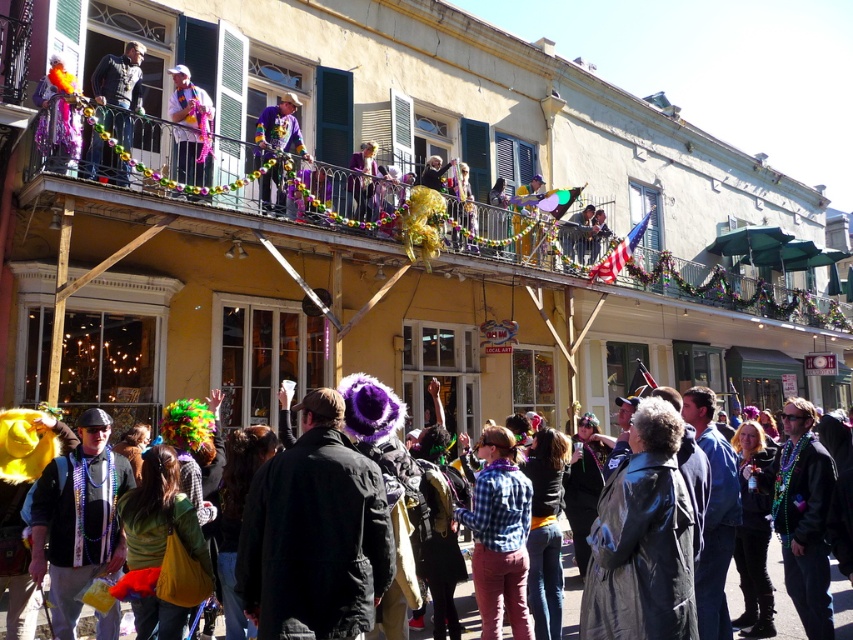
Is matte black jacket at lower left bigger than matte purple hat at upper center?

Correct, matte black jacket at lower left is larger in size than matte purple hat at upper center.

Looking at this image, does matte black jacket at lower left have a lesser width compared to matte purple hat at upper center?

No.

Identify the location of matte black jacket at lower left. (782, 596).

Does matte black jacket at lower left have a greater height compared to matte purple coat at upper center?

Correct, matte black jacket at lower left is much taller as matte purple coat at upper center.

Is point (467, 609) in front of point (358, 189)?

Yes, it is.

Locate an element on the screen. This screenshot has height=640, width=853. matte black jacket at lower left is located at coordinates (782, 596).

Can you confirm if matte purple hat at upper center is smaller than shiny metallic costume at center?

Indeed, matte purple hat at upper center has a smaller size compared to shiny metallic costume at center.

Does matte purple hat at upper center have a larger size compared to shiny metallic costume at center?

Actually, matte purple hat at upper center might be smaller than shiny metallic costume at center.

This screenshot has height=640, width=853. Describe the element at coordinates (190, 128) in the screenshot. I see `matte purple hat at upper center` at that location.

Locate an element on the screen. This screenshot has width=853, height=640. matte purple hat at upper center is located at coordinates (190, 128).